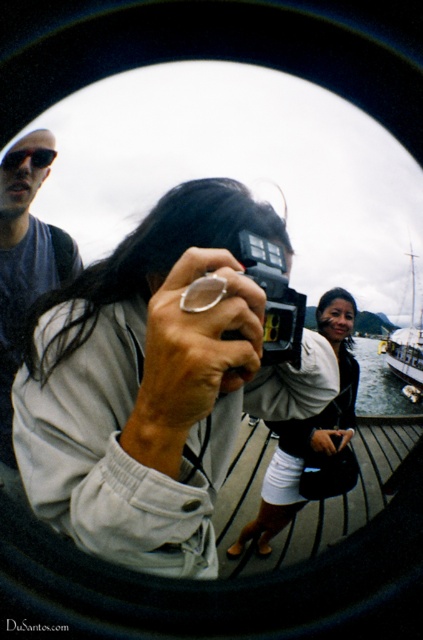
You are a photographer trying to decide which item to use next. You have the black plastic camera at center and the matte black sunglasses at upper left. Which item is larger?

The black plastic camera at center is bigger than the matte black sunglasses at upper left.

What object is located at the coordinates point (274, 300) in the image?

The point (274, 300) marks the location of the black plastic camera at center.

You are a photographer trying to position your equipment. You have a black plastic camera at center and matte black sunglasses at upper left. Which object is positioned to the right side?

The black plastic camera at center is positioned to the right of the matte black sunglasses at upper left.